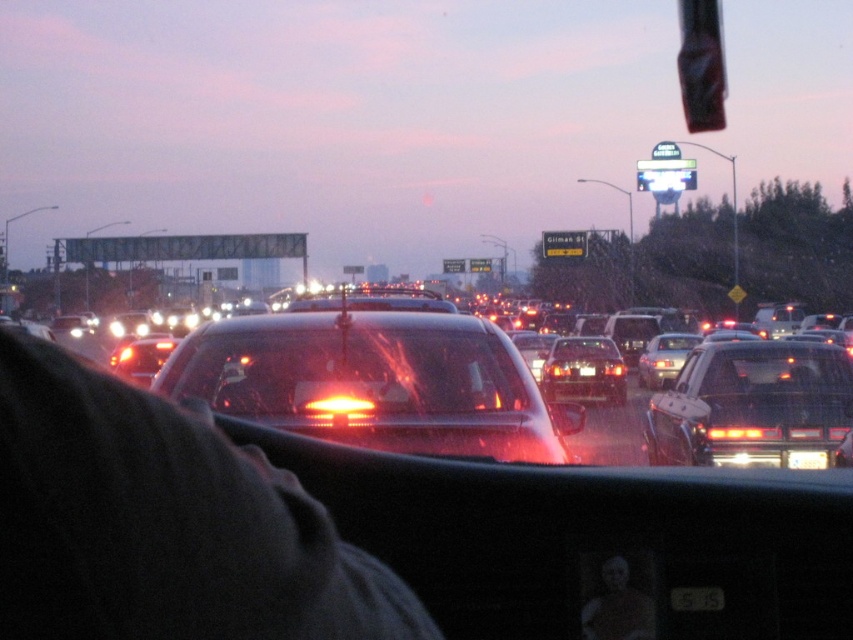
What do you see at coordinates (752, 406) in the screenshot?
I see `matte black suv at right` at bounding box center [752, 406].

Does point (810, 416) come in front of point (714, 595)?

No, (810, 416) is behind (714, 595).

Is point (715, 358) positioned before point (706, 588)?

No, (715, 358) is behind (706, 588).

You are a GUI agent. You are given a task and a screenshot of the screen. Output one action in this format:
    pyautogui.click(x=<x>, y=<y>)
    Task: Click on the matte black suv at right
    The width and height of the screenshot is (853, 640).
    Given the screenshot: What is the action you would take?
    pyautogui.click(x=752, y=406)

Is glossy black sedan at center taller than matte black suv at right?

Correct, glossy black sedan at center is much taller as matte black suv at right.

Which is more to the left, glossy black sedan at center or matte black suv at right?

glossy black sedan at center is more to the left.

The width and height of the screenshot is (853, 640). What do you see at coordinates (386, 380) in the screenshot?
I see `glossy black sedan at center` at bounding box center [386, 380].

Where is `glossy black sedan at center`? glossy black sedan at center is located at coordinates (386, 380).

Is point (711, 88) farther from viewer compared to point (701, 609)?

That is True.

Who is more forward, (x=720, y=10) or (x=712, y=588)?

Point (x=712, y=588) is in front.

The height and width of the screenshot is (640, 853). Describe the element at coordinates (701, 65) in the screenshot. I see `black plastic traffic light at upper right` at that location.

The image size is (853, 640). Find the location of `black plastic traffic light at upper right`. black plastic traffic light at upper right is located at coordinates (701, 65).